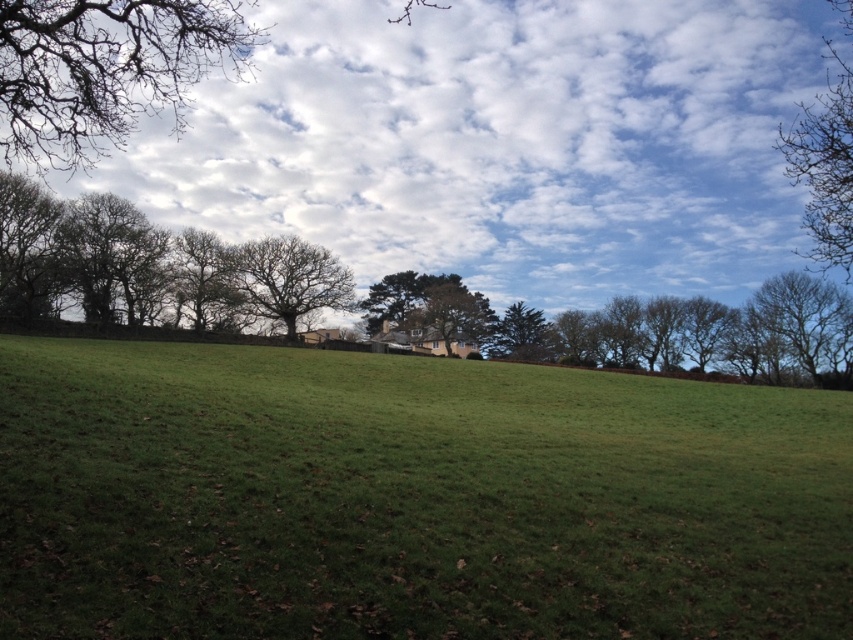
Question: Considering the real-world distances, which object is closest to the bare branches at center?

Choices:
 (A) smooth bark tree at center
 (B) bare branches at right
 (C) green textured tree at center

Answer: (A)

Question: Can you confirm if brown textured tree at left is positioned above smooth bark tree at center?

Choices:
 (A) yes
 (B) no

Answer: (B)

Question: Based on their relative distances, which object is nearer to the bare branches at upper left?

Choices:
 (A) bare branches at center
 (B) green textured tree at center

Answer: (A)

Question: Can you confirm if smooth bark tree at center is positioned to the right of green textured tree at center?

Choices:
 (A) no
 (B) yes

Answer: (A)

Question: Is bare branches at upper left above green leafy tree at left?

Choices:
 (A) no
 (B) yes

Answer: (B)

Question: Which of the following is the farthest from the observer?

Choices:
 (A) green leafy tree at left
 (B) bare branches at right
 (C) bare branches at upper right

Answer: (B)